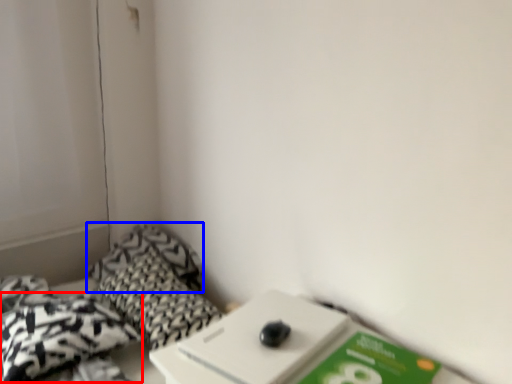
Question: Which point is further to the camera, throw pillow (highlighted by a red box) or pillow (highlighted by a blue box)?

Choices:
 (A) throw pillow
 (B) pillow

Answer: (B)